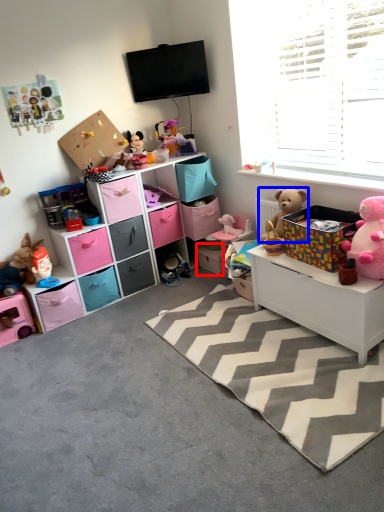
Question: Which point is further to the camera, storage box (highlighted by a red box) or teddy bear (highlighted by a blue box)?

Choices:
 (A) storage box
 (B) teddy bear

Answer: (A)